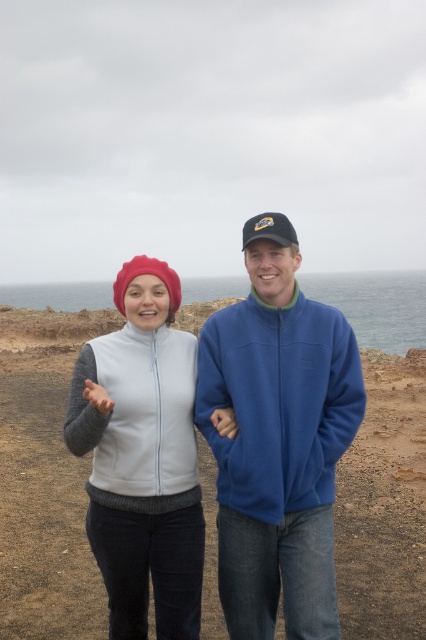
Based on the photo, you are standing on the smooth sand at center and want to reach the blue fleece jacket at center. Which direction should you move to get there?

The smooth sand at center is to the left of blue fleece jacket at center, so you should move to the right to reach the blue fleece jacket at center.

Based on the photo, you are a photographer trying to capture a closeup of the blue fleece jacket at center and the matte white vest at center. Since both are at the same location, which one will be more visible in the photo?

The blue fleece jacket at center is positioned over matte white vest at center, so the blue fleece jacket at center will be more visible in the photo.